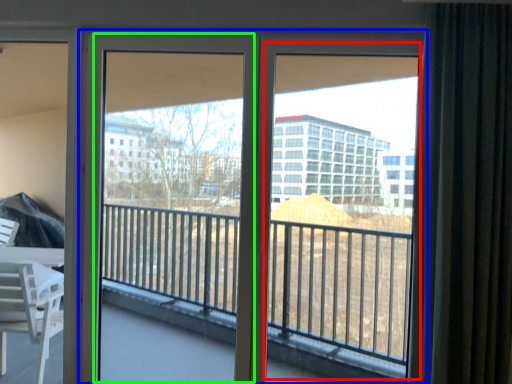
Question: Which object is the farthest from window screen (highlighted by a red box)? Choose among these: door (highlighted by a blue box) or screen door (highlighted by a green box).

Choices:
 (A) door
 (B) screen door

Answer: (B)